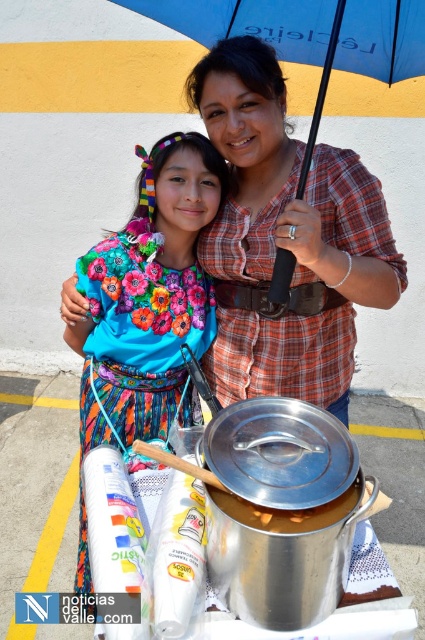
You are a fashion designer observing the scene. You need to determine which item has a smaller width between the plaid fabric shirt at center and the blue fabric umbrella at upper center. Which one is it?

The plaid fabric shirt at center is thinner than the blue fabric umbrella at upper center, so the plaid fabric shirt at center has a smaller width.

You are a fashion designer observing the two outfits in the image. Which fabric has a larger area between the plaid fabric shirt at center and the floral fabric dress at center?

The plaid fabric shirt at center has a larger area than the floral fabric dress at center.